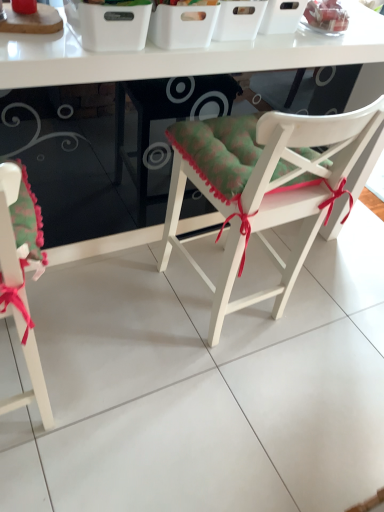
This screenshot has height=512, width=384. I want to click on free space underneath matte green cushion at lower left, acting as the 2th chair starting from the right (from a real-world perspective), so click(13, 388).